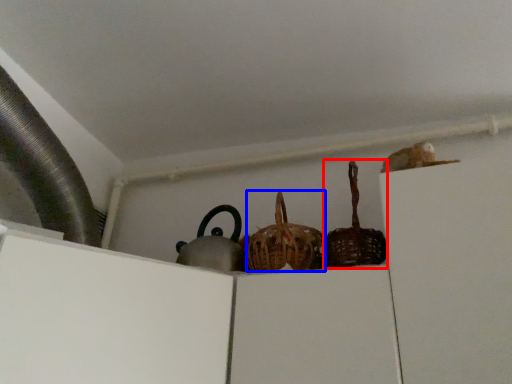
Question: Which of the following is the farthest to the observer, basket (highlighted by a red box) or basket (highlighted by a blue box)?

Choices:
 (A) basket
 (B) basket

Answer: (B)